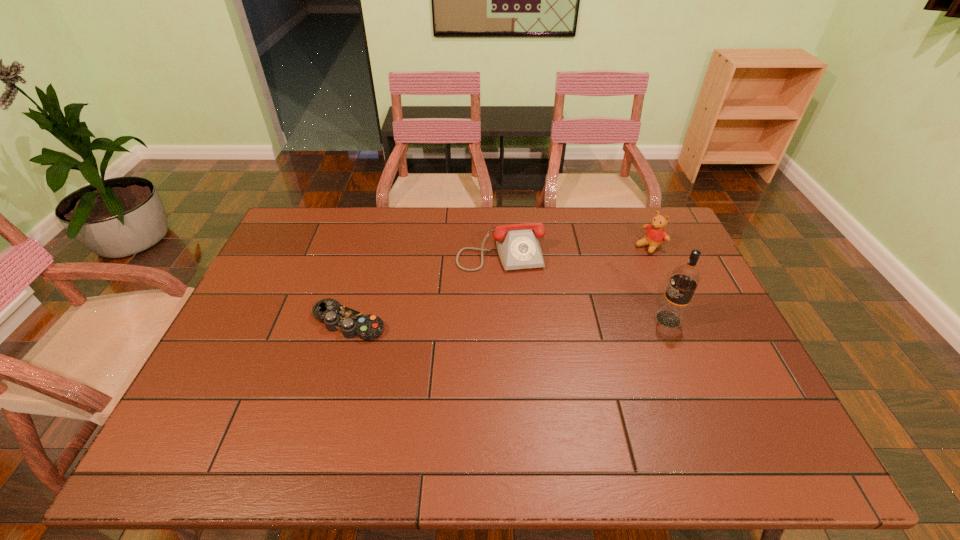
The width and height of the screenshot is (960, 540). Find the location of `the leftmost object`. the leftmost object is located at coordinates (336, 317).

Where is `control`? Image resolution: width=960 pixels, height=540 pixels. control is located at coordinates (336, 317).

The image size is (960, 540). Find the location of `the tallest object`. the tallest object is located at coordinates (685, 278).

Locate an element on the screen. The width and height of the screenshot is (960, 540). teddy bear is located at coordinates (655, 235).

This screenshot has height=540, width=960. In order to click on the third tallest object in this screenshot , I will do `click(518, 247)`.

Find the location of a particular element. the third object from right to left is located at coordinates (518, 247).

This screenshot has height=540, width=960. Find the location of `blank space located 0.360m on the right of the shortest object`. blank space located 0.360m on the right of the shortest object is located at coordinates (514, 322).

This screenshot has height=540, width=960. Identify the location of free region located on the label of the vodka. (627, 319).

At what (x,y) coordinates should I click in order to perform the action: click on free point located 0.310m on the label of the vodka. Please return your answer as a coordinate pair (x, y). Image resolution: width=960 pixels, height=540 pixels. Looking at the image, I should click on (545, 319).

Locate an element on the screen. The height and width of the screenshot is (540, 960). free space located 0.090m on the label of the vodka is located at coordinates click(623, 319).